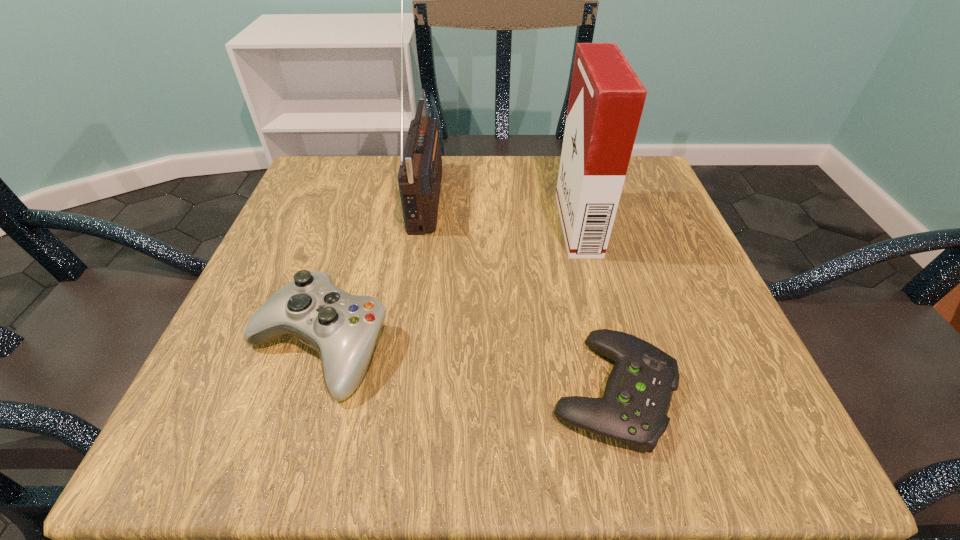
Identify the location of radio receiver. (420, 173).

This screenshot has width=960, height=540. In order to click on cigarette_case in this screenshot , I will do 606,101.

Identify the location of the third tallest object. (343, 328).

Locate an element on the screen. The height and width of the screenshot is (540, 960). the left control is located at coordinates (343, 328).

This screenshot has height=540, width=960. Identify the location of the right control. (638, 393).

Find the location of a particular element. This screenshot has height=540, width=960. the shortest object is located at coordinates (638, 393).

This screenshot has height=540, width=960. I want to click on vacant space located on the front-facing side of the radio receiver, so click(586, 195).

Where is `vacant space located 0.180m on the front-facing side of the cigarette_case`? Image resolution: width=960 pixels, height=540 pixels. vacant space located 0.180m on the front-facing side of the cigarette_case is located at coordinates (470, 225).

Image resolution: width=960 pixels, height=540 pixels. I want to click on blank area located 0.080m on the front-facing side of the cigarette_case, so click(x=521, y=225).

Identify the location of blank space located 0.250m on the front-facing side of the cigarette_case. The image size is (960, 540). (435, 225).